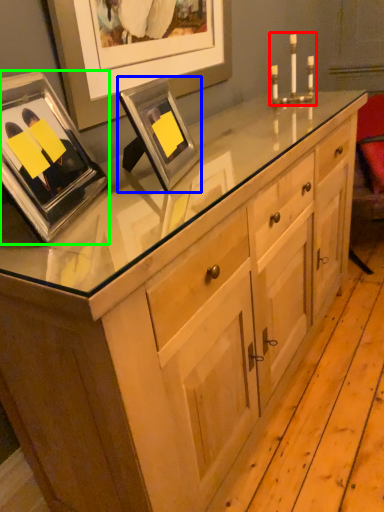
Question: Estimate the real-world distances between objects in this image. Which object is closer to candle holder (highlighted by a red box), picture frame (highlighted by a blue box) or picture frame (highlighted by a green box)?

Choices:
 (A) picture frame
 (B) picture frame

Answer: (A)